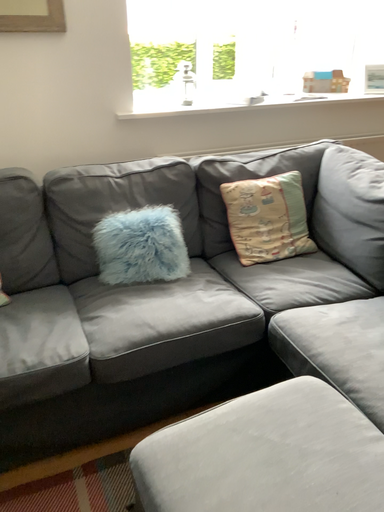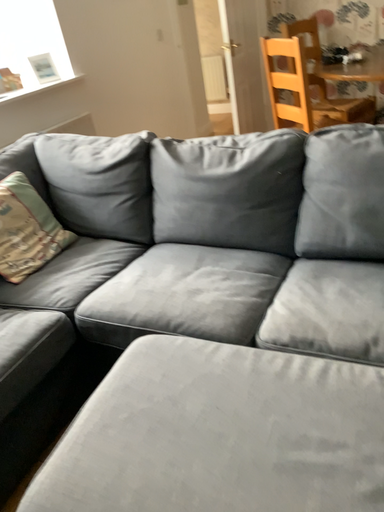
Question: Which way did the camera rotate in the video?

Choices:
 (A) rotated right
 (B) rotated left

Answer: (A)